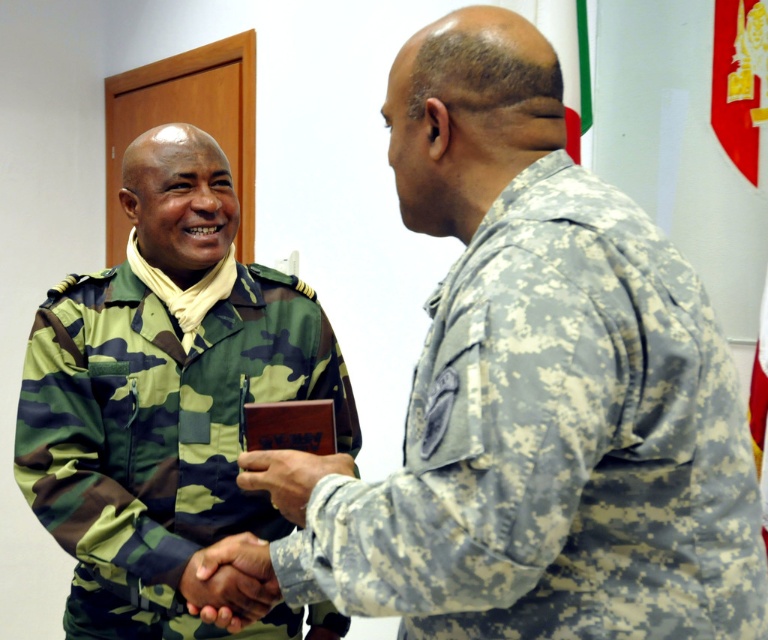
Question: Observing the image, what is the correct spatial positioning of camouflage fabric uniform at right in reference to camo fabric uniform at left?

Choices:
 (A) right
 (B) left

Answer: (A)

Question: Which object is farther from the camera taking this photo?

Choices:
 (A) camouflage fabric uniform at right
 (B) camo fabric uniform at left

Answer: (B)

Question: Is camo fabric uniform at left thinner than dark skin textured hand at center?

Choices:
 (A) yes
 (B) no

Answer: (B)

Question: Which of the following is the closest to the observer?

Choices:
 (A) (210, 582)
 (B) (538, 445)
 (C) (270, 627)

Answer: (B)

Question: Can you confirm if camouflage fabric uniform at right is positioned to the right of dark skin textured hand at center?

Choices:
 (A) no
 (B) yes

Answer: (B)

Question: Which point appears farthest from the camera in this image?

Choices:
 (A) (267, 566)
 (B) (234, 509)
 (C) (627, 298)

Answer: (B)